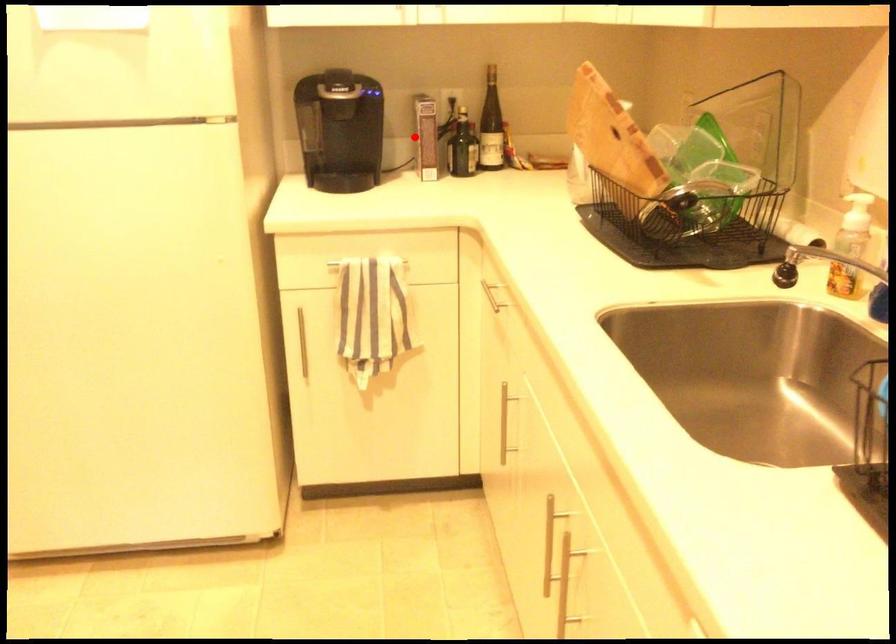
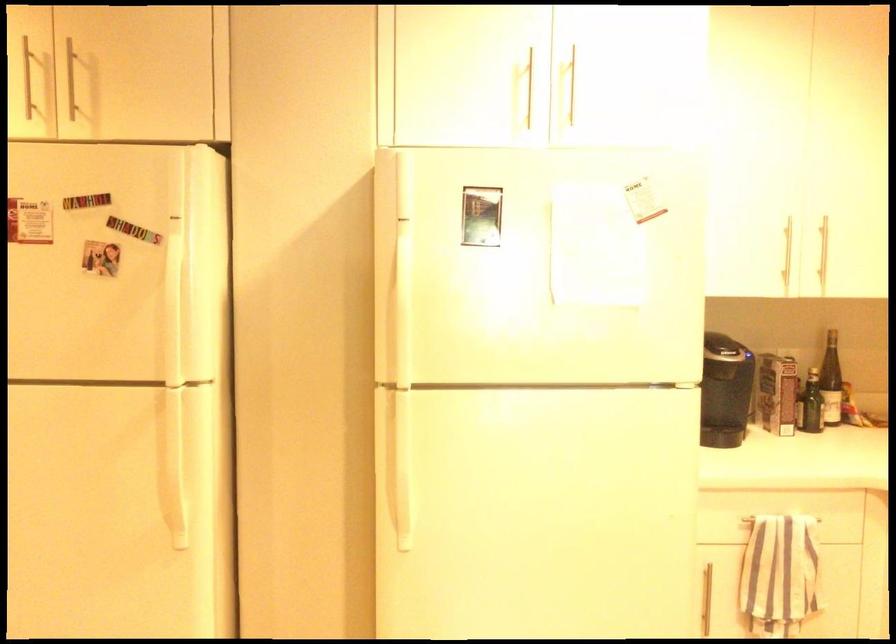
Where in the second image is the point corresponding to the highlighted location from the first image?

(777, 393)